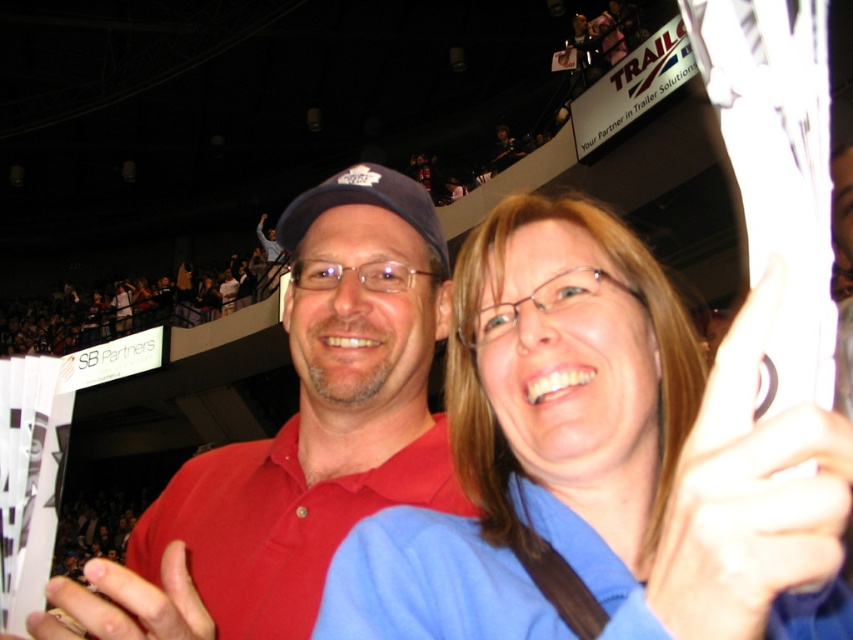
Does blue fabric shirt at center have a greater height compared to matte red shirt at center?

Incorrect, blue fabric shirt at center's height is not larger of matte red shirt at center's.

Between blue fabric shirt at center and matte red shirt at center, which one is positioned lower?

blue fabric shirt at center is below.

Does point (848, 468) lie in front of point (317, 556)?

Yes.

Find the location of a particular element. blue fabric shirt at center is located at coordinates (602, 460).